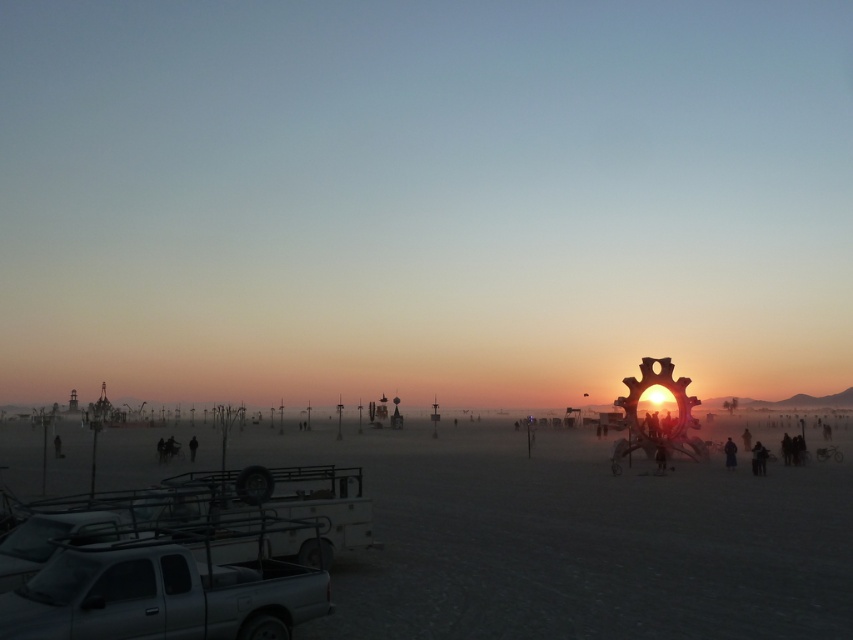
Between point (189, 440) and point (61, 445), which one is positioned behind?

Point (189, 440)

Is black fabric person at lower left taller than black matte person at lower left?

Indeed, black fabric person at lower left has a greater height compared to black matte person at lower left.

Find the location of a particular element. This screenshot has height=640, width=853. black fabric person at lower left is located at coordinates (192, 448).

Which is more to the right, dark fabric figure at center or black fabric person at lower left?

dark fabric figure at center is more to the right.

Can you confirm if dark fabric figure at center is positioned below black fabric person at lower left?

No.

Does point (663, 468) come behind point (194, 456)?

No, (663, 468) is closer to viewer.

Identify the location of dark fabric figure at center. (660, 458).

Is dark gray fabric jacket at lower right above black matte person at lower left?

Yes.

Based on the photo, does dark gray fabric jacket at lower right appear on the left side of black matte person at lower left?

No, dark gray fabric jacket at lower right is not to the left of black matte person at lower left.

Identify the location of dark gray fabric jacket at lower right. The width and height of the screenshot is (853, 640). (758, 458).